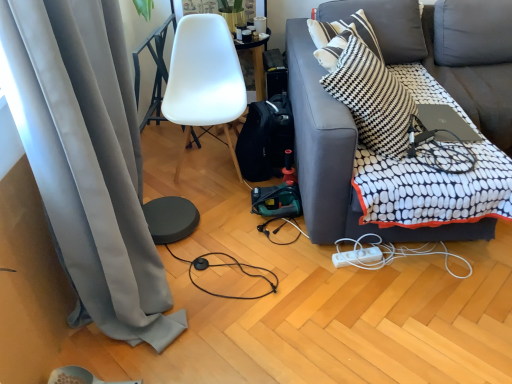
Find the location of a particular element. The image size is (512, 384). vacant space to the left of white plastic power strip at lower right is located at coordinates (322, 290).